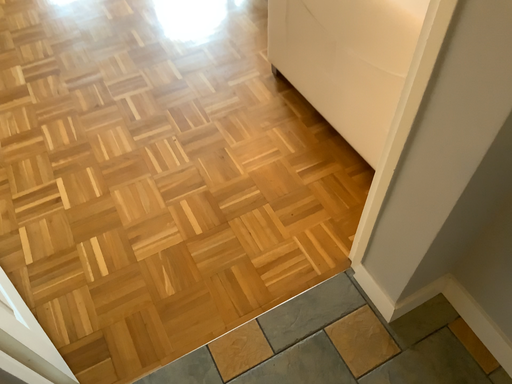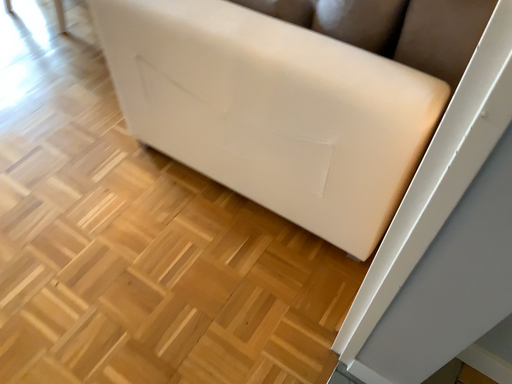
Question: Which way did the camera rotate in the video?

Choices:
 (A) rotated right
 (B) rotated left

Answer: (A)